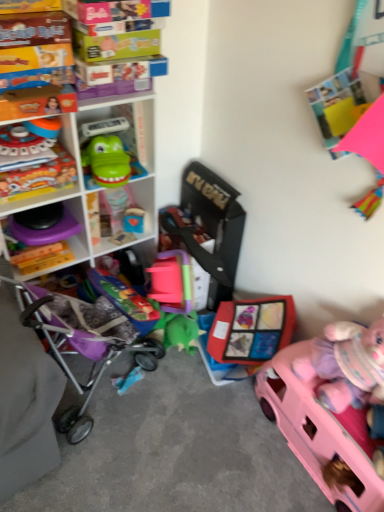
Question: In which direction should I rotate to look at matte plastic toy at center, arranged as the fifth toy when viewed from the left?

Choices:
 (A) left
 (B) right

Answer: (B)

Question: Does purple fabric baby carriage at lower left have a greater width compared to green rubber toy at center-left, the 3th toy viewed from the left?

Choices:
 (A) no
 (B) yes

Answer: (B)

Question: Does purple fabric baby carriage at lower left contain green rubber toy at center-left, the 3th toy viewed from the left?

Choices:
 (A) yes
 (B) no

Answer: (B)

Question: Is the position of purple fabric baby carriage at lower left less distant than that of green rubber toy at center-left, marked as the fourth toy in a right-to-left arrangement?

Choices:
 (A) no
 (B) yes

Answer: (B)

Question: Considering the relative sizes of purple fabric baby carriage at lower left and green rubber toy at center-left, marked as the fourth toy in a right-to-left arrangement, in the image provided, is purple fabric baby carriage at lower left smaller than green rubber toy at center-left, marked as the fourth toy in a right-to-left arrangement,?

Choices:
 (A) yes
 (B) no

Answer: (B)

Question: Is purple fabric baby carriage at lower left outside of green rubber toy at center-left, the 3th toy viewed from the left?

Choices:
 (A) no
 (B) yes

Answer: (B)

Question: From a real-world perspective, does purple fabric baby carriage at lower left sit lower than green rubber toy at center-left, the 3th toy viewed from the left?

Choices:
 (A) no
 (B) yes

Answer: (B)

Question: Does purple fabric baby carriage at lower left have a greater height compared to white plastic shelf at upper left, the second shelf from the bottom?

Choices:
 (A) no
 (B) yes

Answer: (A)

Question: From the image's perspective, would you say purple fabric baby carriage at lower left is positioned over white plastic shelf at upper left, positioned as the 1th shelf in top-to-bottom order?

Choices:
 (A) no
 (B) yes

Answer: (A)

Question: Is the depth of purple fabric baby carriage at lower left greater than that of white plastic shelf at upper left, the second shelf from the bottom?

Choices:
 (A) no
 (B) yes

Answer: (A)

Question: Is purple fabric baby carriage at lower left oriented towards white plastic shelf at upper left, the second shelf from the bottom?

Choices:
 (A) no
 (B) yes

Answer: (A)

Question: Does purple fabric baby carriage at lower left have a lesser height compared to white plastic shelf at upper left, the second shelf from the bottom?

Choices:
 (A) yes
 (B) no

Answer: (A)

Question: Is purple fabric baby carriage at lower left bigger than white plastic shelf at upper left, positioned as the 1th shelf in top-to-bottom order?

Choices:
 (A) no
 (B) yes

Answer: (A)

Question: Is wooden block at center, arranged as the 4th toy when viewed from the left, smaller than pink plastic car at lower right, acting as the first toy starting from the right?

Choices:
 (A) yes
 (B) no

Answer: (A)